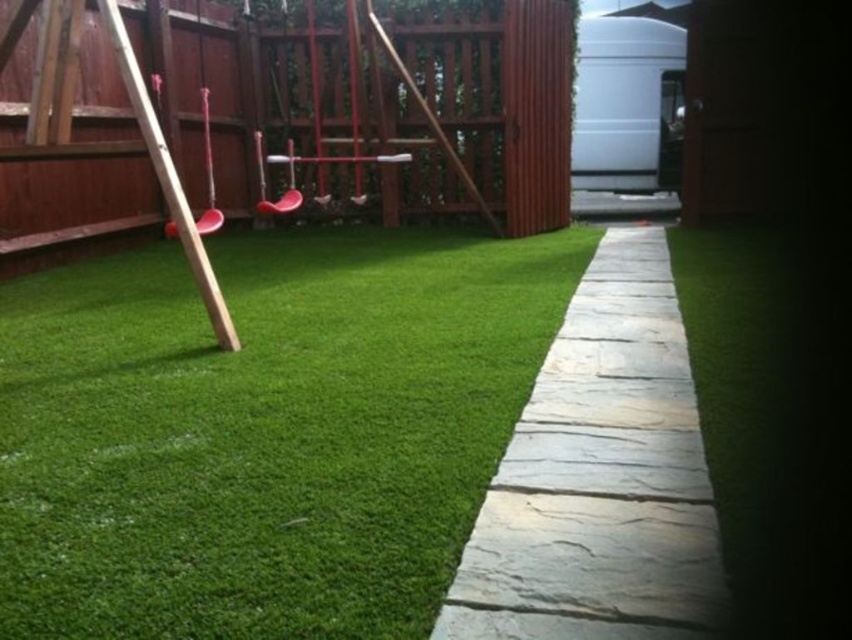
Question: Is wooden fence at upper left positioned in front of gray stone path at center?

Choices:
 (A) no
 (B) yes

Answer: (A)

Question: Which is nearer to the gray stone path at center?

Choices:
 (A) green artificial turf at center
 (B) wooden fence at upper left

Answer: (A)

Question: Does green artificial turf at center have a lesser width compared to wooden fence at upper left?

Choices:
 (A) yes
 (B) no

Answer: (A)

Question: Based on their relative distances, which object is farther from the green artificial turf at center?

Choices:
 (A) gray stone path at center
 (B) wooden fence at upper left

Answer: (B)

Question: Is green artificial turf at center positioned before wooden fence at upper left?

Choices:
 (A) no
 (B) yes

Answer: (B)

Question: Which of the following is the farthest from the observer?

Choices:
 (A) (223, 131)
 (B) (619, 355)
 (C) (574, 269)

Answer: (A)